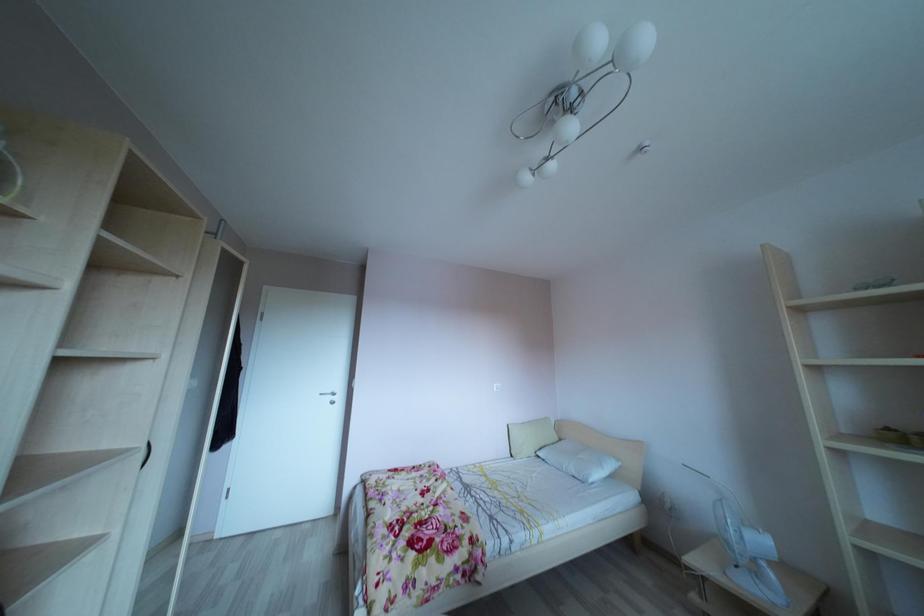
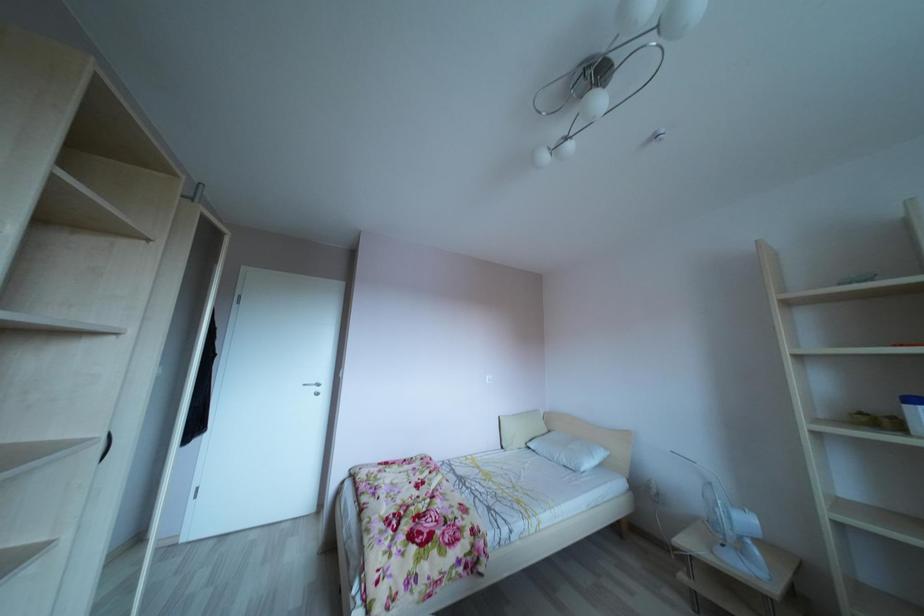
In a continuous first-person perspective shot, in which direction is the camera moving?

The cameraman moved toward left, forward.